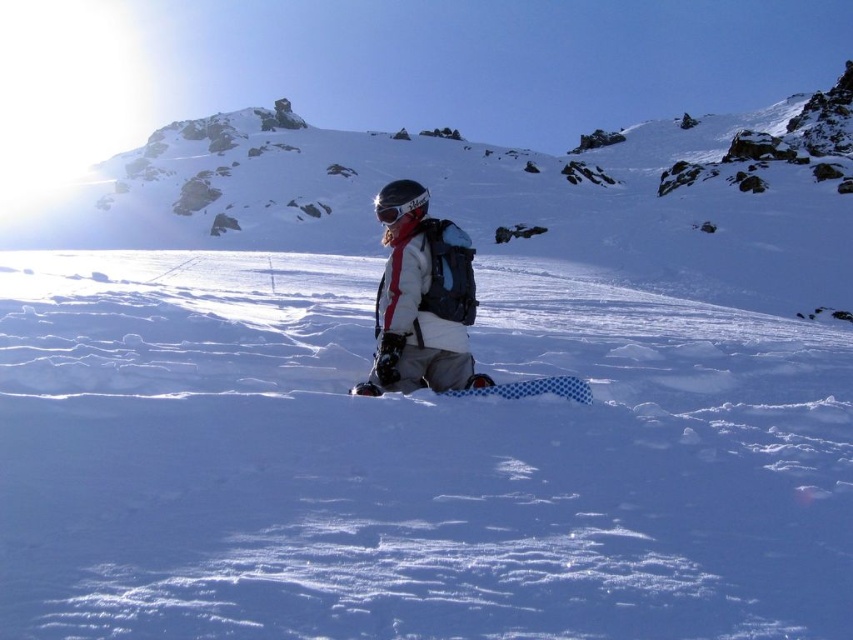
You are planning to take a photo of the winter scene. The photographer wants to ensure both the white matte jacket at center and the blue checkered snowboard at center are clearly visible. Considering their sizes, which object should be placed closer to the camera to maintain clarity?

The white matte jacket at center has a smaller width than the blue checkered snowboard at center. To maintain clarity for both, the white matte jacket at center should be placed closer to the camera since it is smaller and needs to be enlarged in the photo to be as visible as the larger snowboard.

You are planning to carry both the blue checkered snowboard at center and the matte black goggles at center in your backpack. Given their sizes, which one will require more space in the backpack?

The blue checkered snowboard at center requires more space in the backpack because its width is larger than that of the matte black goggles at center.